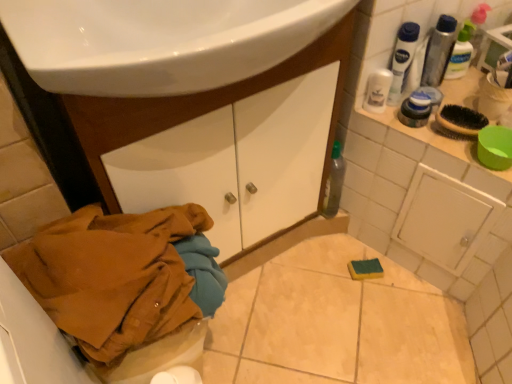
Question: Relative to translucent plastic mouthwash at upper right, placed as the first mouthwash when sorted from right to left, is translucent plastic mouthwash at upper right, positioned as the 2th mouthwash in right-to-left order, in front or behind?

Choices:
 (A) behind
 (B) front

Answer: (B)

Question: Do you think translucent plastic mouthwash at upper right, the third mouthwash positioned from the left, is within translucent plastic mouthwash at upper right, which appears as the fourth mouthwash when viewed from the left, or outside of it?

Choices:
 (A) inside
 (B) outside

Answer: (B)

Question: Estimate the real-world distances between objects in this image. Which object is closer to the matte black shaving cream at upper right?

Choices:
 (A) white plastic mouthwash at upper right, which is the 2th mouthwash from left to right
 (B) translucent plastic mouthwash at upper right, positioned as the 2th mouthwash in right-to-left order
 (C) white plastic mouthwash at upper right, marked as the first mouthwash in a left-to-right arrangement
 (D) brown cotton jacket at lower left
 (E) translucent plastic mouthwash at upper right, placed as the first mouthwash when sorted from right to left

Answer: (C)

Question: Which object is positioned farthest from the translucent plastic mouthwash at upper right, placed as the first mouthwash when sorted from right to left?

Choices:
 (A) matte black shaving cream at upper right
 (B) translucent plastic mouthwash at upper right, positioned as the 2th mouthwash in right-to-left order
 (C) white plastic mouthwash at upper right, marked as the first mouthwash in a left-to-right arrangement
 (D) brown cotton jacket at lower left
 (E) white plastic mouthwash at upper right, which is the 2th mouthwash from left to right

Answer: (D)